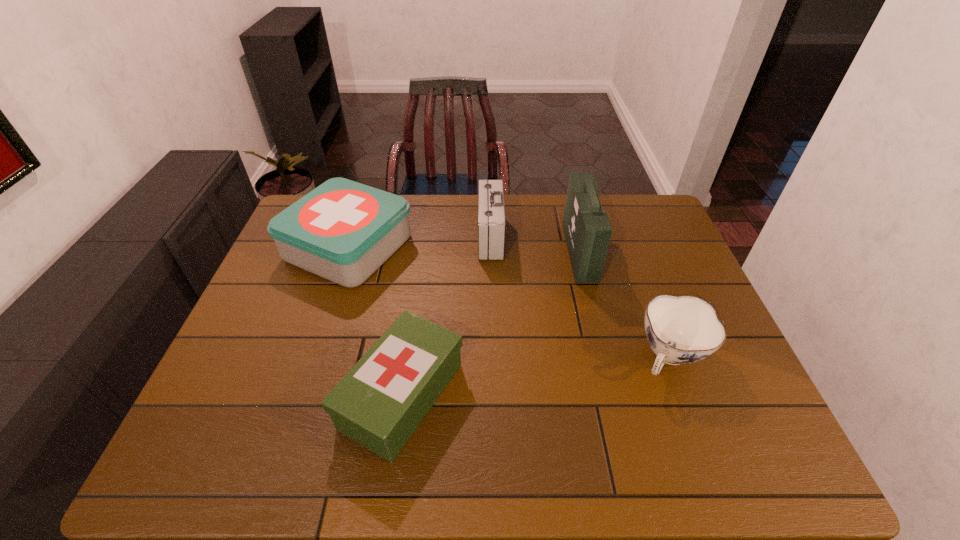
This screenshot has width=960, height=540. I want to click on blank space that satisfies the following two spatial constraints: 1. on the front-facing side of the rightmost object; 2. on the left side of the second object from right to left, so click(605, 357).

Find the location of a particular element. This screenshot has width=960, height=540. vacant area in the image that satisfies the following two spatial constraints: 1. on the front-facing side of the second first-aid kit from right to left; 2. on the front side of the shortest first-aid kit is located at coordinates (494, 396).